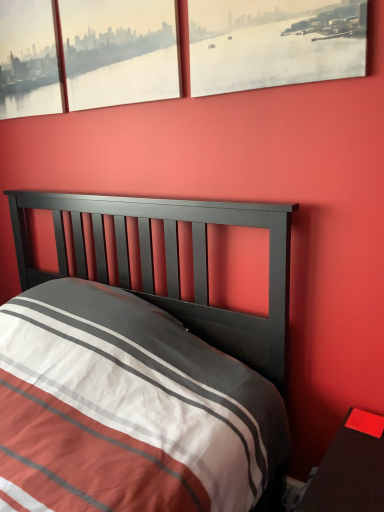
What do you see at coordinates (28, 59) in the screenshot? I see `matte glass window at upper left, acting as the first window starting from the left` at bounding box center [28, 59].

The height and width of the screenshot is (512, 384). What do you see at coordinates (274, 42) in the screenshot?
I see `matte paper cityscape at upper right, positioned as the 1th window in right-to-left order` at bounding box center [274, 42].

The height and width of the screenshot is (512, 384). In order to click on matte glass window at upper left, acting as the first window starting from the left in this screenshot , I will do `click(28, 59)`.

From a real-world perspective, count 3rd windows upward from the smooth glossy wood nightstand at lower right and point to it. Please provide its 2D coordinates.

[(28, 59)]

From a real-world perspective, is matte glass window at upper left, the 3th window viewed from the right, over smooth glossy wood nightstand at lower right?

Yes, from a real-world perspective, matte glass window at upper left, the 3th window viewed from the right, is on top of smooth glossy wood nightstand at lower right.

Would you say matte glass window at upper left, the 3th window viewed from the right, is to the left or to the right of smooth glossy wood nightstand at lower right in the picture?

matte glass window at upper left, the 3th window viewed from the right, is positioned on smooth glossy wood nightstand at lower right's left side.

How distant is matte glass window at upper left, acting as the first window starting from the left, from smooth glossy wood nightstand at lower right?

matte glass window at upper left, acting as the first window starting from the left, is 5.98 feet away from smooth glossy wood nightstand at lower right.

Which is more to the right, matte paper cityscape at upper right, positioned as the 1th window in right-to-left order, or matte glass window at upper left, acting as the first window starting from the left?

matte paper cityscape at upper right, positioned as the 1th window in right-to-left order, is more to the right.

Measure the distance from matte paper cityscape at upper right, the 3th window in the left-to-right sequence, to matte glass window at upper left, the 3th window viewed from the right.

35.59 inches.

Is the surface of matte paper cityscape at upper right, positioned as the 1th window in right-to-left order, in direct contact with matte glass window at upper left, acting as the first window starting from the left?

No, matte paper cityscape at upper right, positioned as the 1th window in right-to-left order, is not in contact with matte glass window at upper left, acting as the first window starting from the left.

Is matte paper cityscape at upper right, the 3th window in the left-to-right sequence, spatially inside matte glass window at upper left, acting as the first window starting from the left, or outside of it?

The correct answer is: outside.

Is smooth glossy wood nightstand at lower right positioned far away from matte glass window at upper left, acting as the first window starting from the left?

Indeed, smooth glossy wood nightstand at lower right is not near matte glass window at upper left, acting as the first window starting from the left.

From a real-world perspective, which object rests below the other?

smooth glossy wood nightstand at lower right is physically lower.

Is smooth glossy wood nightstand at lower right facing towards matte glass window at upper left, the 3th window viewed from the right?

No, smooth glossy wood nightstand at lower right is not turned towards matte glass window at upper left, the 3th window viewed from the right.

From the picture: Considering the sizes of objects matte glass window at upper left, arranged as the second window when viewed from the right, and matte paper cityscape at upper right, the 3th window in the left-to-right sequence, in the image provided, who is wider, matte glass window at upper left, arranged as the second window when viewed from the right, or matte paper cityscape at upper right, the 3th window in the left-to-right sequence,?

Wider between the two is matte glass window at upper left, arranged as the second window when viewed from the right.

Is matte glass window at upper left, arranged as the second window when viewed from the right, facing away from matte paper cityscape at upper right, the 3th window in the left-to-right sequence?

No, matte glass window at upper left, arranged as the second window when viewed from the right, is not facing away from matte paper cityscape at upper right, the 3th window in the left-to-right sequence.

From a real-world perspective, does matte glass window at upper left, arranged as the 2th window when viewed from the left, stand above matte paper cityscape at upper right, positioned as the 1th window in right-to-left order?

Yes, from a real-world perspective, matte glass window at upper left, arranged as the 2th window when viewed from the left, is on top of matte paper cityscape at upper right, positioned as the 1th window in right-to-left order.

Considering the relative positions of matte glass window at upper left, arranged as the second window when viewed from the right, and matte paper cityscape at upper right, positioned as the 1th window in right-to-left order, in the image provided, is matte glass window at upper left, arranged as the second window when viewed from the right, behind matte paper cityscape at upper right, positioned as the 1th window in right-to-left order,?

Yes, the depth of matte glass window at upper left, arranged as the second window when viewed from the right, is greater than that of matte paper cityscape at upper right, positioned as the 1th window in right-to-left order.

Is matte paper cityscape at upper right, positioned as the 1th window in right-to-left order, completely or partially outside of smooth glossy wood nightstand at lower right?

Absolutely, matte paper cityscape at upper right, positioned as the 1th window in right-to-left order, is external to smooth glossy wood nightstand at lower right.

Does matte paper cityscape at upper right, positioned as the 1th window in right-to-left order, have a smaller size compared to smooth glossy wood nightstand at lower right?

Indeed, matte paper cityscape at upper right, positioned as the 1th window in right-to-left order, has a smaller size compared to smooth glossy wood nightstand at lower right.

Is matte paper cityscape at upper right, positioned as the 1th window in right-to-left order, oriented away from smooth glossy wood nightstand at lower right?

That's not correct — matte paper cityscape at upper right, positioned as the 1th window in right-to-left order, is not looking away from smooth glossy wood nightstand at lower right.

How many degrees apart are the facing directions of matte paper cityscape at upper right, positioned as the 1th window in right-to-left order, and smooth glossy wood nightstand at lower right?

The angular difference between matte paper cityscape at upper right, positioned as the 1th window in right-to-left order, and smooth glossy wood nightstand at lower right is 0.994 degrees.

Where is `window that is the 1st one when counting leftward from the smooth glossy wood nightstand at lower right`? The image size is (384, 512). window that is the 1st one when counting leftward from the smooth glossy wood nightstand at lower right is located at coordinates (274, 42).

Can you tell me how much smooth glossy wood nightstand at lower right and matte paper cityscape at upper right, the 3th window in the left-to-right sequence, differ in facing direction?

0.994 degrees separate the facing orientations of smooth glossy wood nightstand at lower right and matte paper cityscape at upper right, the 3th window in the left-to-right sequence.

Is smooth glossy wood nightstand at lower right touching matte paper cityscape at upper right, the 3th window in the left-to-right sequence?

No.

Could you tell me if smooth glossy wood nightstand at lower right is turned towards matte paper cityscape at upper right, the 3th window in the left-to-right sequence?

No.

Is matte glass window at upper left, the 3th window viewed from the right, aimed at matte glass window at upper left, arranged as the 2th window when viewed from the left?

Result: No, matte glass window at upper left, the 3th window viewed from the right, is not facing towards matte glass window at upper left, arranged as the 2th window when viewed from the left.

Find the location of a particular element. window that is the 1st object located in front of the matte glass window at upper left, the 3th window viewed from the right is located at coordinates (85, 54).

What's the angular difference between matte glass window at upper left, acting as the first window starting from the left, and matte glass window at upper left, arranged as the 2th window when viewed from the left,'s facing directions?

The angle between the facing direction of matte glass window at upper left, acting as the first window starting from the left, and the facing direction of matte glass window at upper left, arranged as the 2th window when viewed from the left, is 0.47 degrees.

Is matte glass window at upper left, acting as the first window starting from the left, in front of or behind matte glass window at upper left, arranged as the 2th window when viewed from the left, in the image?

matte glass window at upper left, acting as the first window starting from the left, is behind matte glass window at upper left, arranged as the 2th window when viewed from the left.

In the image, there is a matte glass window at upper left, the 3th window viewed from the right. Identify the location of nightstand below it (from a real-world perspective). (348, 475).

Locate an element on the screen. Image resolution: width=384 pixels, height=512 pixels. window that is the 2nd one above the matte paper cityscape at upper right, the 3th window in the left-to-right sequence (from a real-world perspective) is located at coordinates (28, 59).

Which object lies further to the anchor point smooth glossy wood nightstand at lower right, matte glass window at upper left, acting as the first window starting from the left, or matte glass window at upper left, arranged as the second window when viewed from the right?

Based on the image, matte glass window at upper left, acting as the first window starting from the left, appears to be further to smooth glossy wood nightstand at lower right.

In the scene shown: Which object lies further to the anchor point matte paper cityscape at upper right, the 3th window in the left-to-right sequence, matte glass window at upper left, arranged as the second window when viewed from the right, or matte glass window at upper left, acting as the first window starting from the left?

matte glass window at upper left, acting as the first window starting from the left, is further to matte paper cityscape at upper right, the 3th window in the left-to-right sequence.

When comparing their distances from matte glass window at upper left, arranged as the 2th window when viewed from the left, does matte glass window at upper left, acting as the first window starting from the left, or smooth glossy wood nightstand at lower right seem further?

smooth glossy wood nightstand at lower right is positioned further to the anchor matte glass window at upper left, arranged as the 2th window when viewed from the left.

Estimate the real-world distances between objects in this image. Which object is further from smooth glossy wood nightstand at lower right, matte glass window at upper left, arranged as the 2th window when viewed from the left, or matte glass window at upper left, the 3th window viewed from the right?

matte glass window at upper left, the 3th window viewed from the right, is further to smooth glossy wood nightstand at lower right.

Considering their positions, is matte glass window at upper left, the 3th window viewed from the right, positioned closer to smooth glossy wood nightstand at lower right than matte paper cityscape at upper right, positioned as the 1th window in right-to-left order?

matte paper cityscape at upper right, positioned as the 1th window in right-to-left order, is positioned closer to the anchor smooth glossy wood nightstand at lower right.

Considering their positions, is matte paper cityscape at upper right, positioned as the 1th window in right-to-left order, positioned further to matte glass window at upper left, arranged as the second window when viewed from the right, than matte glass window at upper left, the 3th window viewed from the right?

Based on the image, matte paper cityscape at upper right, positioned as the 1th window in right-to-left order, appears to be further to matte glass window at upper left, arranged as the second window when viewed from the right.

Looking at the image, which one is located closer to smooth glossy wood nightstand at lower right, matte paper cityscape at upper right, positioned as the 1th window in right-to-left order, or matte glass window at upper left, the 3th window viewed from the right?

Among the two, matte paper cityscape at upper right, positioned as the 1th window in right-to-left order, is located nearer to smooth glossy wood nightstand at lower right.

When comparing their distances from matte glass window at upper left, arranged as the second window when viewed from the right, does smooth glossy wood nightstand at lower right or matte glass window at upper left, the 3th window viewed from the right, seem further?

smooth glossy wood nightstand at lower right is further to matte glass window at upper left, arranged as the second window when viewed from the right.

What are the coordinates of `window located between matte glass window at upper left, the 3th window viewed from the right, and matte paper cityscape at upper right, positioned as the 1th window in right-to-left order, in the left-right direction` in the screenshot? It's located at (85, 54).

Find the location of a particular element. The height and width of the screenshot is (512, 384). window that lies between matte glass window at upper left, arranged as the 2th window when viewed from the left, and smooth glossy wood nightstand at lower right from top to bottom is located at coordinates (274, 42).